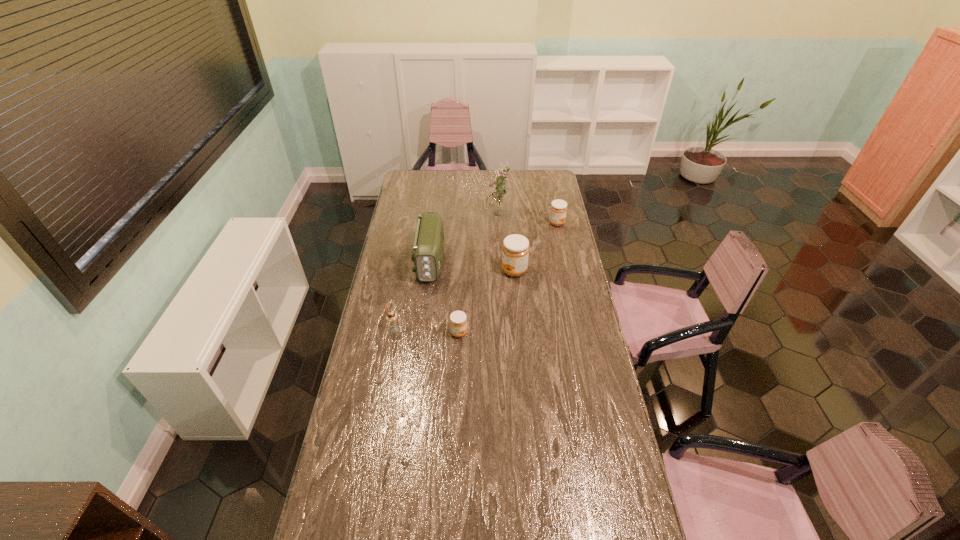
You are a GUI agent. You are given a task and a screenshot of the screen. Output one action in this format:
    pyautogui.click(x=<x>, y=<y>)
    Task: Click on the free spot that satisfies the following two spatial constraints: 1. on the front label of the rightmost jam; 2. on the front side of the leftmost object
    
    Given the screenshot: What is the action you would take?
    pyautogui.click(x=580, y=329)

Where is `free region that satisfies the following two spatial constraints: 1. on the front-facing side of the tallest object; 2. on the front-facing side of the radio_receiver`? This screenshot has width=960, height=540. free region that satisfies the following two spatial constraints: 1. on the front-facing side of the tallest object; 2. on the front-facing side of the radio_receiver is located at coordinates (500, 262).

Where is `vacant space that satisfies the following two spatial constraints: 1. on the front-facing side of the tallest object; 2. on the front-facing side of the radio_receiver`? vacant space that satisfies the following two spatial constraints: 1. on the front-facing side of the tallest object; 2. on the front-facing side of the radio_receiver is located at coordinates (500, 262).